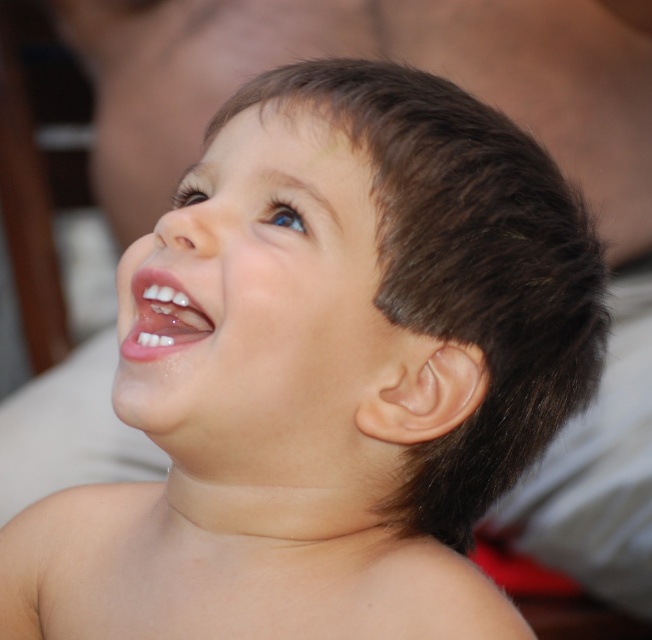
Does smooth skin face at center appear over white glossy teeth at center?

Yes.

Locate an element on the screen. This screenshot has width=652, height=640. smooth skin face at center is located at coordinates (256, 291).